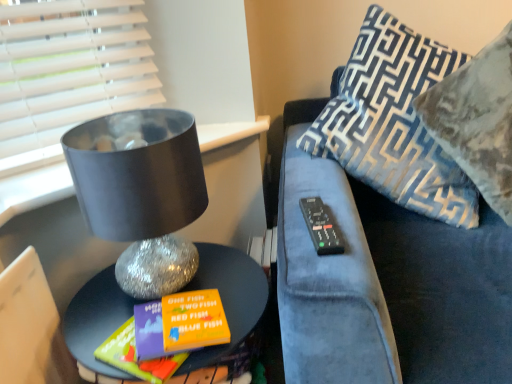
The width and height of the screenshot is (512, 384). Describe the element at coordinates (394, 122) in the screenshot. I see `blue patterned pillow at right, acting as the second pillow starting from the right` at that location.

The image size is (512, 384). What do you see at coordinates (386, 283) in the screenshot?
I see `velvet blue couch at upper right` at bounding box center [386, 283].

Measure the distance between point (128, 280) and camera.

34.41 inches.

Measure the distance between matte black lampshade at left and camera.

The distance of matte black lampshade at left from camera is 27.43 inches.

The width and height of the screenshot is (512, 384). Find the location of `velvet-patterned pillow at upper right, the 1th pillow in the right-to-left sequence`. velvet-patterned pillow at upper right, the 1th pillow in the right-to-left sequence is located at coordinates (477, 120).

Find the location of `blue patterned pillow at right, acting as the second pillow starting from the right`. blue patterned pillow at right, acting as the second pillow starting from the right is located at coordinates (394, 122).

Is point (154, 219) closer or farther from the camera than point (461, 186)?

Point (154, 219).

Is matte black lampshade at left next to blue patterned pillow at right, which ranks as the first pillow in left-to-right order, and touching it?

No, matte black lampshade at left is not in contact with blue patterned pillow at right, which ranks as the first pillow in left-to-right order.

Between matte black lampshade at left and blue patterned pillow at right, acting as the second pillow starting from the right, which one is positioned in front?

matte black lampshade at left is more forward.

Consider the image. From a real-world perspective, is matte black lampshade at left physically below blue patterned pillow at right, acting as the second pillow starting from the right?

Yes.

Who is shorter, shiny metallic table at lower left or matte black lampshade at left?

With less height is matte black lampshade at left.

Could you tell me if shiny metallic table at lower left is turned towards matte black lampshade at left?

No, shiny metallic table at lower left is not facing towards matte black lampshade at left.

Is shiny metallic table at lower left not inside matte black lampshade at left?

Absolutely, shiny metallic table at lower left is external to matte black lampshade at left.

Looking at their sizes, would you say shiny metallic table at lower left is wider or thinner than matte black lampshade at left?

Clearly, shiny metallic table at lower left has more width compared to matte black lampshade at left.

From a real-world perspective, is shiny metallic table at lower left below velvet blue couch at upper right?

Yes, from a real-world perspective, shiny metallic table at lower left is under velvet blue couch at upper right.

In the image, is shiny metallic table at lower left on the left side or the right side of velvet blue couch at upper right?

Clearly, shiny metallic table at lower left is on the left of velvet blue couch at upper right in the image.

Does shiny metallic table at lower left have a greater width compared to velvet blue couch at upper right?

No.

Between point (100, 326) and point (465, 283), which one is positioned in front?

The point (100, 326) is closer.

Is blue patterned pillow at right, which ranks as the first pillow in left-to-right order, bigger or smaller than velvet blue couch at upper right?

Clearly, blue patterned pillow at right, which ranks as the first pillow in left-to-right order, is smaller in size than velvet blue couch at upper right.

Is velvet blue couch at upper right located within blue patterned pillow at right, acting as the second pillow starting from the right?

No, velvet blue couch at upper right is not a part of blue patterned pillow at right, acting as the second pillow starting from the right.

From the picture: Is blue patterned pillow at right, which ranks as the first pillow in left-to-right order, positioned with its back to velvet blue couch at upper right?

Yes, velvet blue couch at upper right is at the back of blue patterned pillow at right, which ranks as the first pillow in left-to-right order.

Considering the relative sizes of velvet-patterned pillow at upper right, positioned as the second pillow in left-to-right order, and blue patterned pillow at right, which ranks as the first pillow in left-to-right order, in the image provided, is velvet-patterned pillow at upper right, positioned as the second pillow in left-to-right order, shorter than blue patterned pillow at right, which ranks as the first pillow in left-to-right order,?

Yes, velvet-patterned pillow at upper right, positioned as the second pillow in left-to-right order, is shorter than blue patterned pillow at right, which ranks as the first pillow in left-to-right order.

Where is `pillow above the velvet-patterned pillow at upper right, the 1th pillow in the right-to-left sequence (from a real-world perspective)`? The width and height of the screenshot is (512, 384). pillow above the velvet-patterned pillow at upper right, the 1th pillow in the right-to-left sequence (from a real-world perspective) is located at coordinates (394, 122).

Is velvet-patterned pillow at upper right, the 1th pillow in the right-to-left sequence, oriented towards blue patterned pillow at right, acting as the second pillow starting from the right?

Yes, velvet-patterned pillow at upper right, the 1th pillow in the right-to-left sequence, is turned towards blue patterned pillow at right, acting as the second pillow starting from the right.

Can you see velvet-patterned pillow at upper right, the 1th pillow in the right-to-left sequence, touching blue patterned pillow at right, which ranks as the first pillow in left-to-right order?

velvet-patterned pillow at upper right, the 1th pillow in the right-to-left sequence, and blue patterned pillow at right, which ranks as the first pillow in left-to-right order, are not in contact.

How many degrees apart are the facing directions of matte black lampshade at left and shiny metallic table at lower left?

There is a 7.64-degree angle between the facing directions of matte black lampshade at left and shiny metallic table at lower left.

Does matte black lampshade at left have a greater width compared to shiny metallic table at lower left?

No.

From the image's perspective, which is above, matte black lampshade at left or shiny metallic table at lower left?

matte black lampshade at left.

From a real-world perspective, which object stands above the other?

velvet-patterned pillow at upper right, positioned as the second pillow in left-to-right order.

Which object is positioned more to the left, velvet blue couch at upper right or velvet-patterned pillow at upper right, the 1th pillow in the right-to-left sequence?

velvet blue couch at upper right.

From the image's perspective, is velvet blue couch at upper right positioned above or below velvet-patterned pillow at upper right, the 1th pillow in the right-to-left sequence?

From the image's perspective, velvet blue couch at upper right appears below velvet-patterned pillow at upper right, the 1th pillow in the right-to-left sequence.

Locate an element on the screen. table lamp in front of the blue patterned pillow at right, acting as the second pillow starting from the right is located at coordinates (141, 193).

What are the coordinates of `table lamp that appears above the shiny metallic table at lower left (from a real-world perspective)` in the screenshot? It's located at (141, 193).

Consider the image. From the image, which object appears to be farther from matte black lampshade at left, blue patterned pillow at right, acting as the second pillow starting from the right, or velvet-patterned pillow at upper right, positioned as the second pillow in left-to-right order?

velvet-patterned pillow at upper right, positioned as the second pillow in left-to-right order.

From the image, which object appears to be nearer to velvet blue couch at upper right, blue patterned pillow at right, which ranks as the first pillow in left-to-right order, or velvet-patterned pillow at upper right, the 1th pillow in the right-to-left sequence?

blue patterned pillow at right, which ranks as the first pillow in left-to-right order, is closer to velvet blue couch at upper right.

Looking at the image, which one is located further to shiny metallic table at lower left, blue patterned pillow at right, which ranks as the first pillow in left-to-right order, or matte black lampshade at left?

blue patterned pillow at right, which ranks as the first pillow in left-to-right order, is further to shiny metallic table at lower left.

From the picture: From the image, which object appears to be nearer to velvet blue couch at upper right, shiny metallic table at lower left or velvet-patterned pillow at upper right, positioned as the second pillow in left-to-right order?

Among the two, shiny metallic table at lower left is located nearer to velvet blue couch at upper right.

Which object lies nearer to the anchor point black plastic remote at right, velvet-patterned pillow at upper right, positioned as the second pillow in left-to-right order, or blue patterned pillow at right, which ranks as the first pillow in left-to-right order?

blue patterned pillow at right, which ranks as the first pillow in left-to-right order, is positioned closer to the anchor black plastic remote at right.

Considering their positions, is velvet-patterned pillow at upper right, positioned as the second pillow in left-to-right order, positioned further to velvet blue couch at upper right than blue patterned pillow at right, which ranks as the first pillow in left-to-right order?

Among the two, velvet-patterned pillow at upper right, positioned as the second pillow in left-to-right order, is located further to velvet blue couch at upper right.

Which object lies nearer to the anchor point shiny metallic table at lower left, velvet-patterned pillow at upper right, the 1th pillow in the right-to-left sequence, or black plastic remote at right?

black plastic remote at right lies closer to shiny metallic table at lower left than the other object.

Based on the photo, estimate the real-world distances between objects in this image. Which object is further from black plastic remote at right, matte black lampshade at left or blue patterned pillow at right, which ranks as the first pillow in left-to-right order?

Based on the image, blue patterned pillow at right, which ranks as the first pillow in left-to-right order, appears to be further to black plastic remote at right.

Identify the location of remote situated between matte black lampshade at left and blue patterned pillow at right, which ranks as the first pillow in left-to-right order, from left to right. The height and width of the screenshot is (384, 512). (321, 227).

At what (x,y) coordinates should I click in order to perform the action: click on furniture between shiny metallic table at lower left and velvet-patterned pillow at upper right, positioned as the second pillow in left-to-right order. Please return your answer as a coordinate pair (x, y). Image resolution: width=512 pixels, height=384 pixels. Looking at the image, I should click on (386, 283).

Locate an element on the screen. remote between matte black lampshade at left and shiny metallic table at lower left in the up-down direction is located at coordinates coord(321,227).

The height and width of the screenshot is (384, 512). Find the location of `furniture between black plastic remote at right and velvet-patterned pillow at upper right, the 1th pillow in the right-to-left sequence`. furniture between black plastic remote at right and velvet-patterned pillow at upper right, the 1th pillow in the right-to-left sequence is located at coordinates (386, 283).